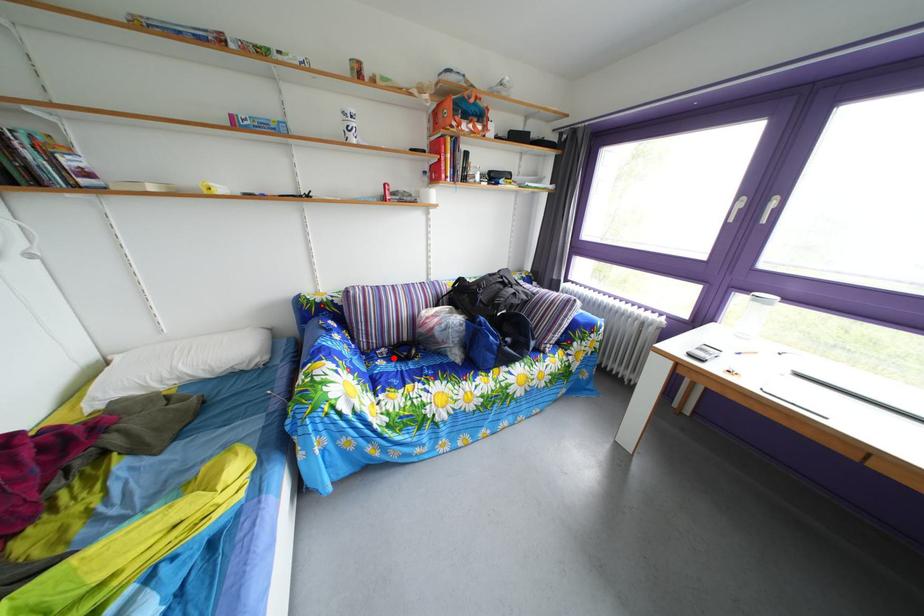
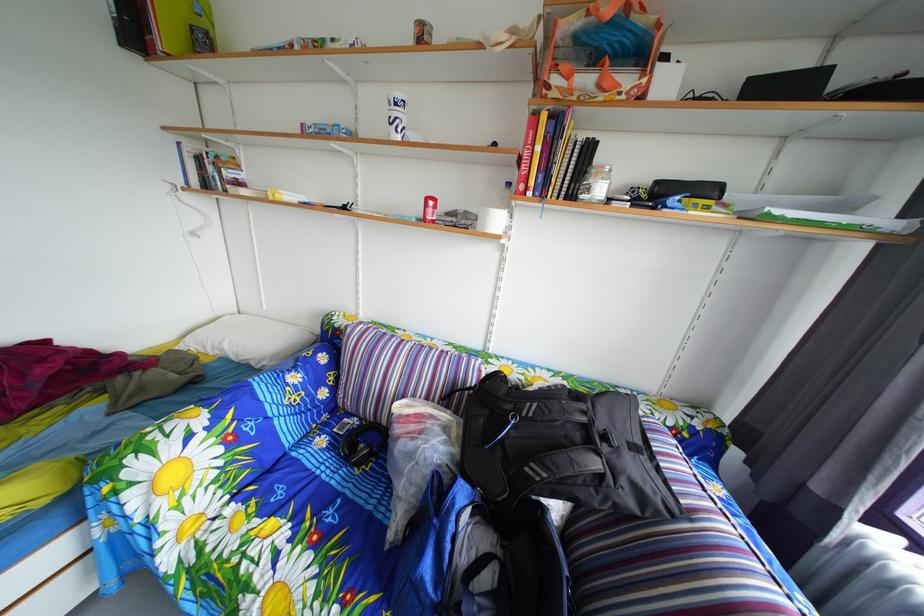
Where in the second image is the point corresponding to the highlighted location from the first image?

(367, 428)